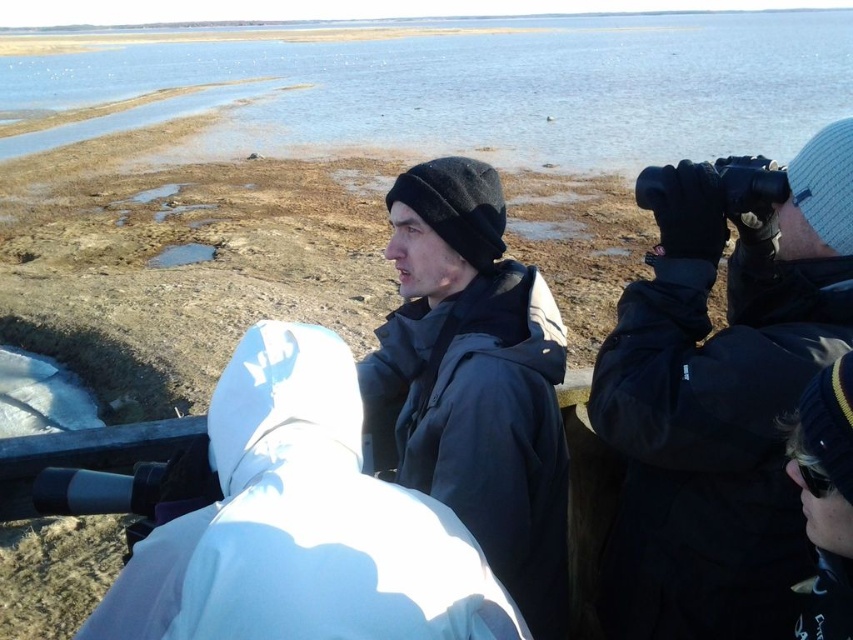
You are a member of the birdwatching group and want to locate the black matte binoculars at upper right. Based on the coordinates provided, where should you look in the image?

You should look at point (720, 401) in the image to find the black matte binoculars at upper right.